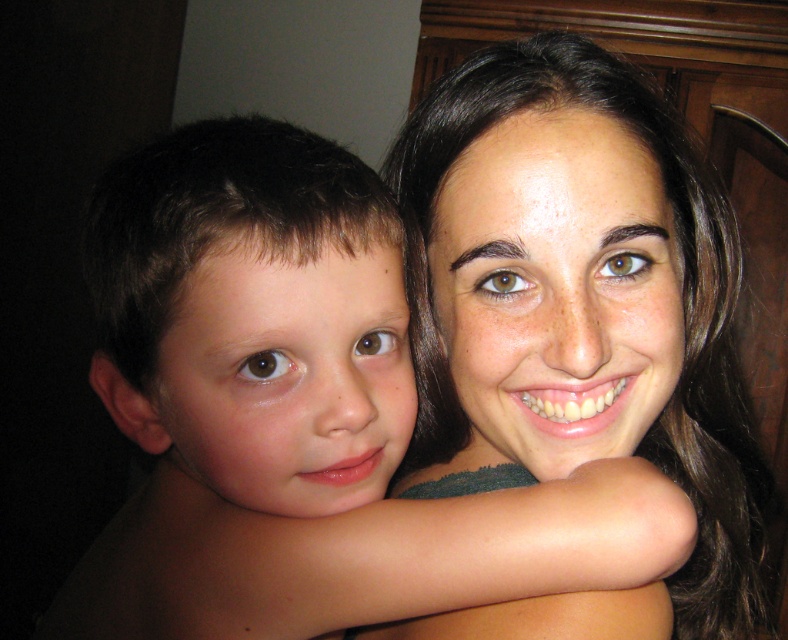
Does smooth skin child at center have a lesser height compared to smooth skin face at upper right?

Correct, smooth skin child at center is not as tall as smooth skin face at upper right.

Does smooth skin child at center appear on the left side of smooth skin face at upper right?

Correct, you'll find smooth skin child at center to the left of smooth skin face at upper right.

Which is behind, point (388, 560) or point (508, 326)?

Point (508, 326)

What are the coordinates of `smooth skin child at center` in the screenshot? It's located at (299, 413).